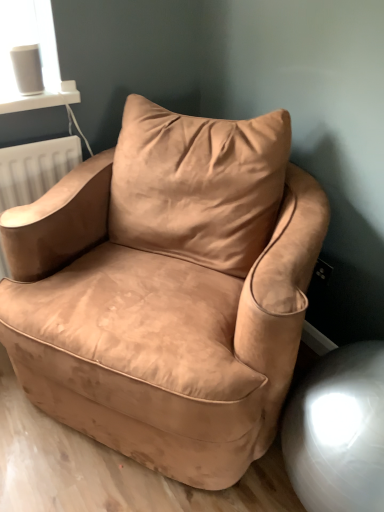
Question: From their relative heights in the image, would you say suede tan swivel chair at lower right is taller or shorter than suede-like beige armchair at center?

Choices:
 (A) short
 (B) tall

Answer: (A)

Question: From a real-world perspective, is suede tan swivel chair at lower right positioned above or below suede-like beige armchair at center?

Choices:
 (A) above
 (B) below

Answer: (B)

Question: Visually, is suede tan swivel chair at lower right positioned to the left or to the right of suede-like beige armchair at center?

Choices:
 (A) right
 (B) left

Answer: (A)

Question: Would you say suede-like beige armchair at center is inside or outside suede tan swivel chair at lower right?

Choices:
 (A) inside
 (B) outside

Answer: (B)

Question: Is point (273, 134) closer or farther from the camera than point (369, 437)?

Choices:
 (A) farther
 (B) closer

Answer: (A)

Question: Is suede-like beige armchair at center to the left or to the right of suede tan swivel chair at lower right in the image?

Choices:
 (A) right
 (B) left

Answer: (B)

Question: In terms of height, does suede-like beige armchair at center look taller or shorter compared to suede tan swivel chair at lower right?

Choices:
 (A) tall
 (B) short

Answer: (A)